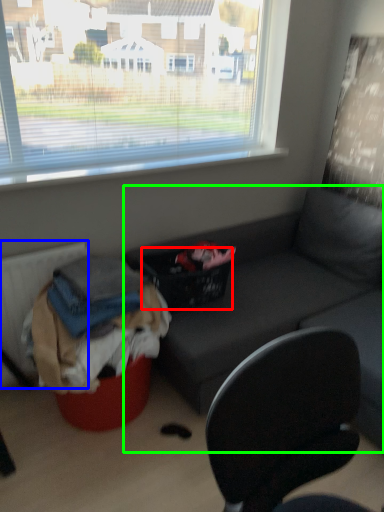
Question: Which object is the farthest from basket (highlighted by a red box)? Choose among these: radiator (highlighted by a blue box) or studio couch (highlighted by a green box).

Choices:
 (A) radiator
 (B) studio couch

Answer: (A)